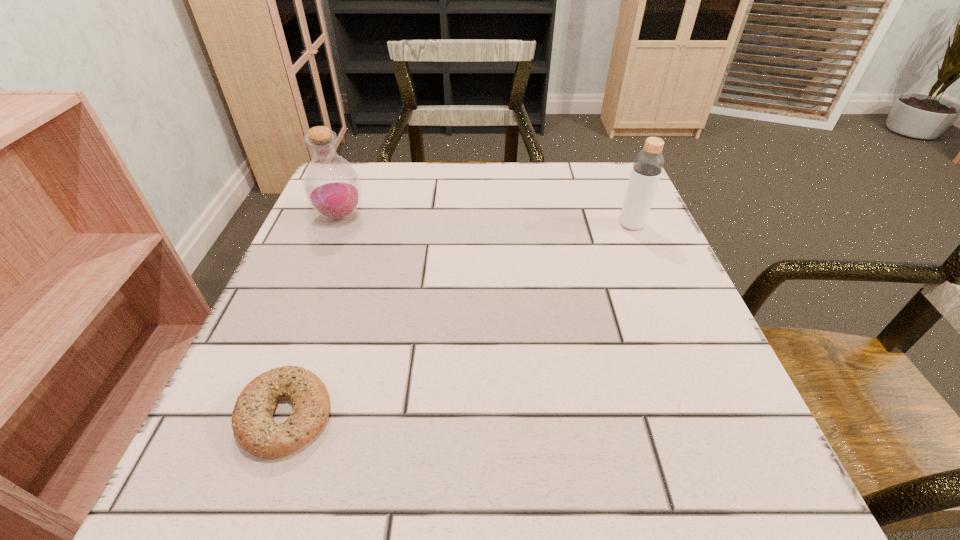
What are the coordinates of `empty space between the left bottle and the shortest object` in the screenshot? It's located at (313, 316).

The width and height of the screenshot is (960, 540). Find the location of `free space between the left bottle and the right bottle`. free space between the left bottle and the right bottle is located at coordinates (486, 221).

Identify the location of free space between the rightmost object and the left bottle. The height and width of the screenshot is (540, 960). (486, 221).

You are a GUI agent. You are given a task and a screenshot of the screen. Output one action in this format:
    pyautogui.click(x=<x>, y=<y>)
    Task: Click on the free space between the bagel and the right bottle
    This screenshot has height=540, width=960.
    Given the screenshot: What is the action you would take?
    pyautogui.click(x=459, y=321)

Where is `free space that is in between the right bottle and the left bottle`? This screenshot has width=960, height=540. free space that is in between the right bottle and the left bottle is located at coordinates tap(486, 221).

Where is `vacant area that lies between the shortest object and the right bottle`? This screenshot has width=960, height=540. vacant area that lies between the shortest object and the right bottle is located at coordinates (459, 321).

At what (x,y) coordinates should I click in order to perform the action: click on vacant area between the right bottle and the shortest object. Please return your answer as a coordinate pair (x, y). The width and height of the screenshot is (960, 540). Looking at the image, I should click on (459, 321).

In order to click on vacant area that lies between the shortest object and the right bottle in this screenshot , I will do `click(459, 321)`.

Where is `free point between the nearest object and the rightmost object`? This screenshot has height=540, width=960. free point between the nearest object and the rightmost object is located at coordinates (459, 321).

Where is `blank region between the right bottle and the left bottle`? The width and height of the screenshot is (960, 540). blank region between the right bottle and the left bottle is located at coordinates [486, 221].